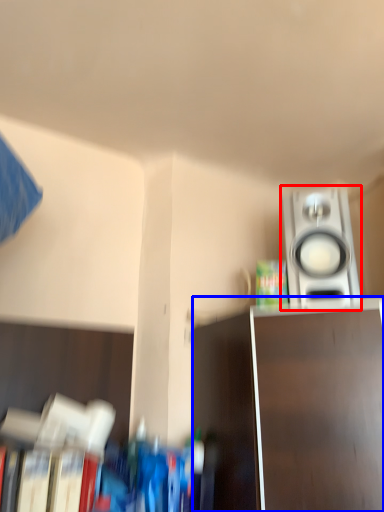
Question: Which of the following is the closest to the observer, home appliance (highlighted by a red box) or furniture (highlighted by a blue box)?

Choices:
 (A) home appliance
 (B) furniture

Answer: (B)